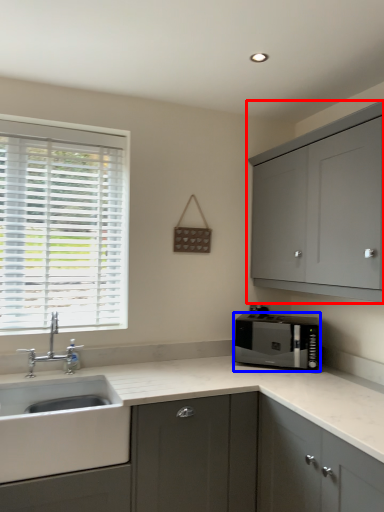
Question: Which of the following is the closest to the observer, cabinetry (highlighted by a red box) or microwave oven (highlighted by a blue box)?

Choices:
 (A) cabinetry
 (B) microwave oven

Answer: (A)